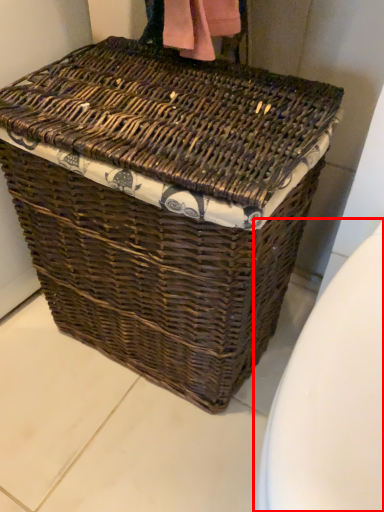
Question: From the image's perspective, considering the relative positions of toilet bowl (annotated by the red box) and picnic basket in the image provided, where is toilet bowl (annotated by the red box) located with respect to the staircase?

Choices:
 (A) below
 (B) above

Answer: (A)